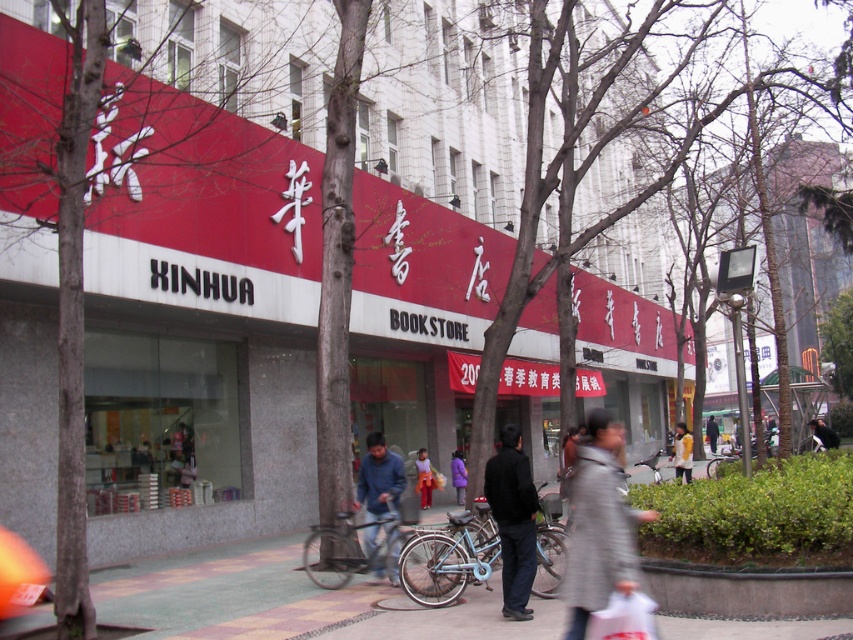
Question: Estimate the real-world distances between objects in this image. Which object is closer to the light gray jacket at center?

Choices:
 (A) dark blue jacket at center
 (B) denim jacket at center
 (C) dark blue jeans at center
 (D) purple fabric coat at center

Answer: (D)

Question: Can you confirm if gray wool coat at center is positioned below dark blue jeans at center?

Choices:
 (A) yes
 (B) no

Answer: (A)

Question: Is blue denim jeans at center further to the viewer compared to light gray jacket at center?

Choices:
 (A) yes
 (B) no

Answer: (B)

Question: Which of the following is the farthest from the observer?

Choices:
 (A) denim jacket at center
 (B) blue denim jeans at center
 (C) matte red bookstore at center

Answer: (A)

Question: Is matte red bookstore at center further to the viewer compared to blue denim jeans at center?

Choices:
 (A) yes
 (B) no

Answer: (B)

Question: Which object appears farthest from the camera in this image?

Choices:
 (A) purple fabric coat at center
 (B) matte red bookstore at center

Answer: (A)